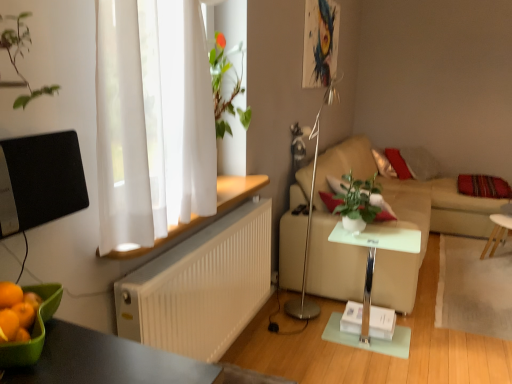
Question: Is white ribbed radiator at lower left bigger or smaller than green glossy houseplant at center?

Choices:
 (A) big
 (B) small

Answer: (A)

Question: Is white ribbed radiator at lower left in front of or behind green glossy houseplant at center in the image?

Choices:
 (A) behind
 (B) front

Answer: (B)

Question: Which is nearer to the green glossy houseplant at center?

Choices:
 (A) striped fabric pillow at right
 (B) white wooden table at right, the 2th table from the left
 (C) beige fabric couch at right
 (D) silver metallic floor lamp at center
 (E) white wood window sill at lower left

Answer: (D)

Question: Which object is the farthest from the white ribbed radiator at lower left?

Choices:
 (A) white wooden table at right, which ranks as the 1th table in right-to-left order
 (B) beige fabric couch at right
 (C) white glossy side table at center, marked as the 2th table in a right-to-left arrangement
 (D) striped fabric pillow at right
 (E) green glossy houseplant at center

Answer: (D)